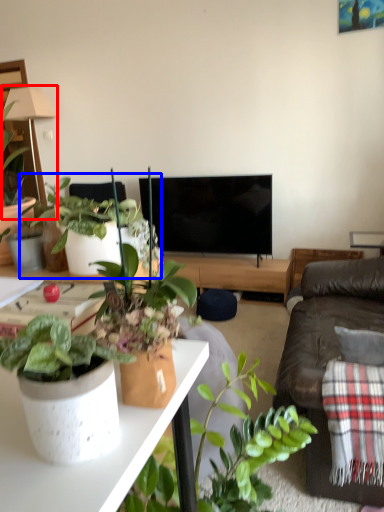
Question: Which point is further to the camera, lamp (highlighted by a red box) or houseplant (highlighted by a blue box)?

Choices:
 (A) lamp
 (B) houseplant

Answer: (A)